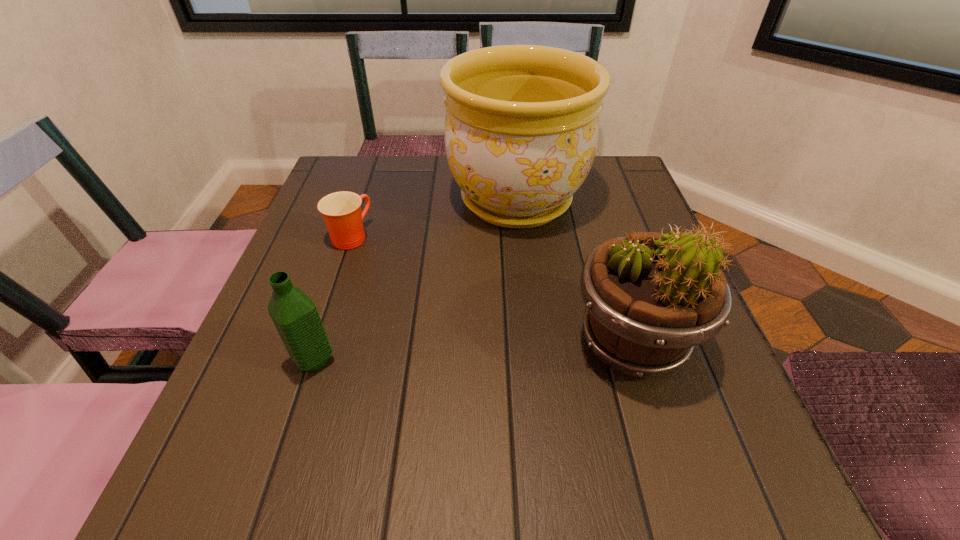
The height and width of the screenshot is (540, 960). I want to click on the farther flowerpot, so click(521, 129).

Where is `the nearer flowerpot`? the nearer flowerpot is located at coordinates (650, 297).

The height and width of the screenshot is (540, 960). Identify the location of water bottle. (294, 314).

Where is `the shortest object`? The height and width of the screenshot is (540, 960). the shortest object is located at coordinates (341, 211).

Where is `free space located 0.210m on the left of the farther flowerpot`? This screenshot has height=540, width=960. free space located 0.210m on the left of the farther flowerpot is located at coordinates (361, 200).

Identify the location of vacant position located on the left of the nearer flowerpot. (466, 343).

The height and width of the screenshot is (540, 960). I want to click on free location located 0.310m on the back of the third tallest object, so click(355, 232).

Find the location of a particular element. Image resolution: width=960 pixels, height=540 pixels. vacant region located 0.170m on the front of the shortest object is located at coordinates (324, 313).

Locate an element on the screen. This screenshot has width=960, height=540. object that is at the far edge is located at coordinates (521, 129).

Locate an element on the screen. water bottle positioned at the left edge is located at coordinates tap(294, 314).